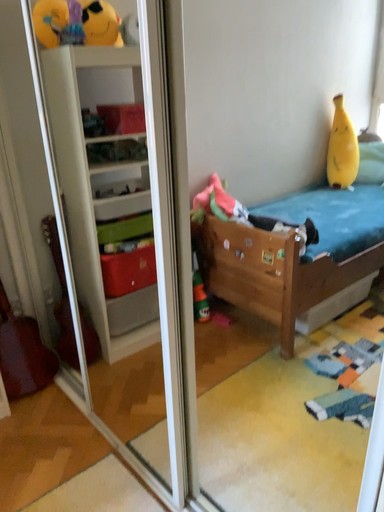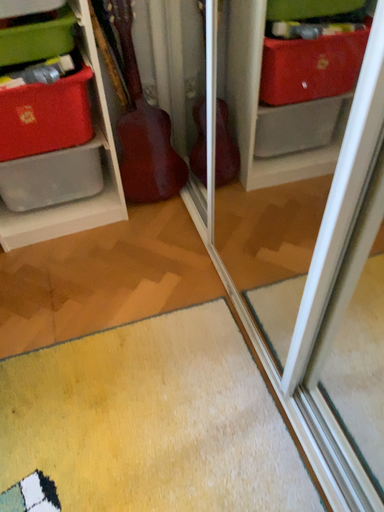
Question: Which way did the camera rotate in the video?

Choices:
 (A) rotated left
 (B) rotated right

Answer: (A)